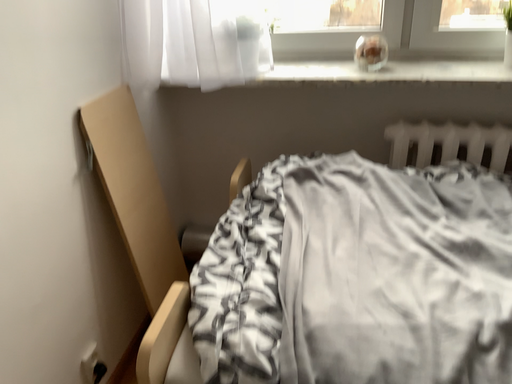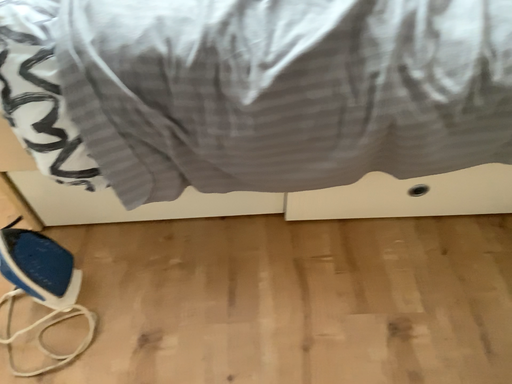
Question: How did the camera likely rotate when shooting the video?

Choices:
 (A) rotated left
 (B) rotated right

Answer: (B)